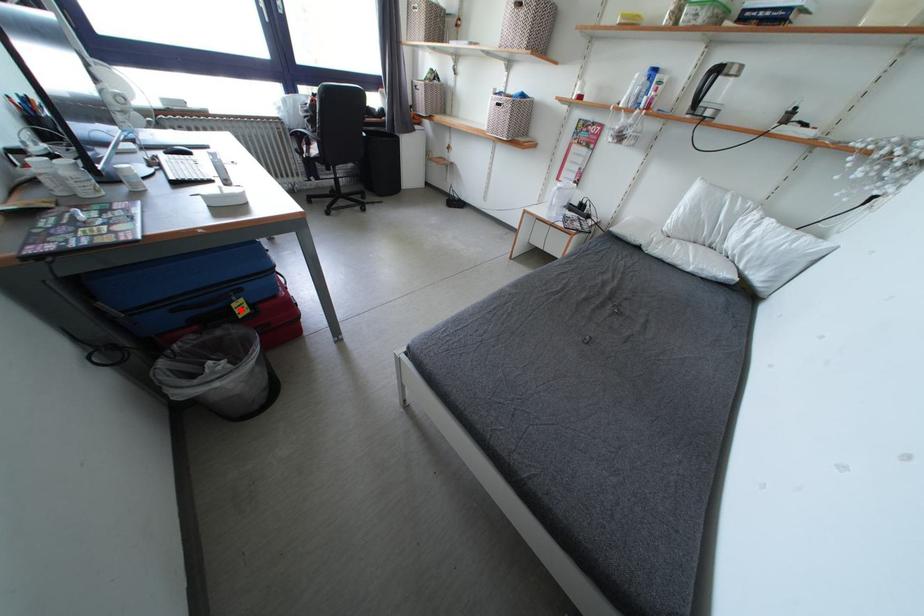
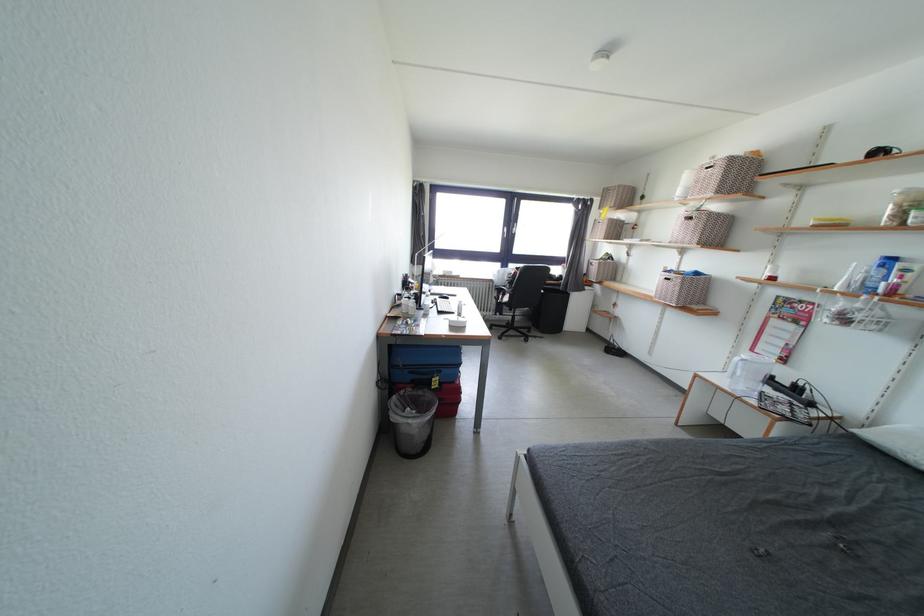
The point at the highlighted location is marked in the first image. Where is the corresponding point in the second image?

(440, 384)